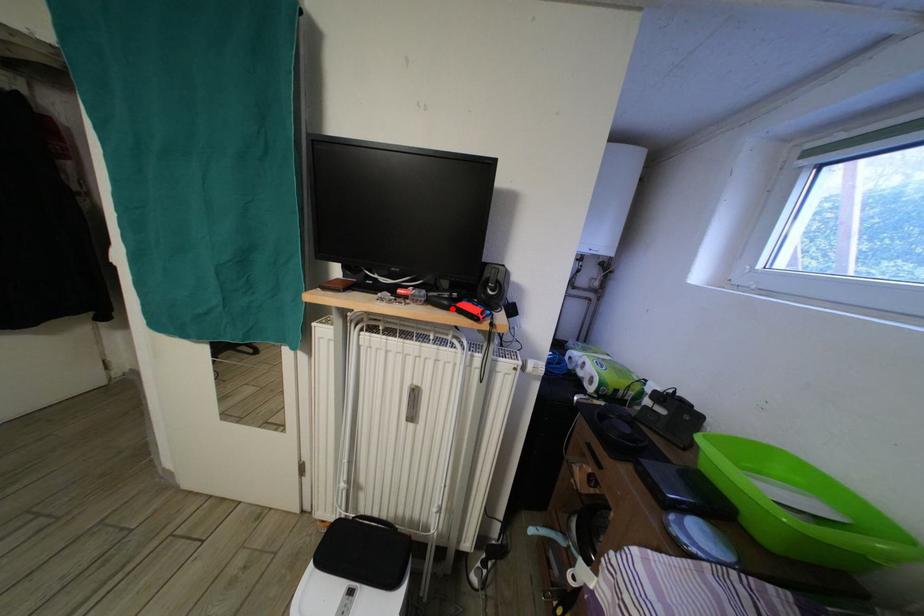
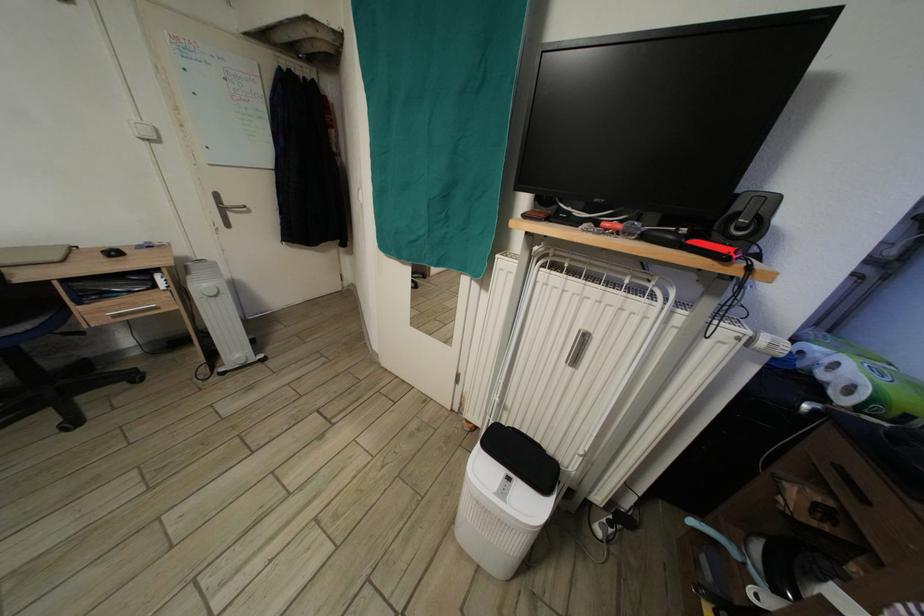
The point at the highlighted location is marked in the first image. Where is the corresponding point in the second image?

(675, 245)